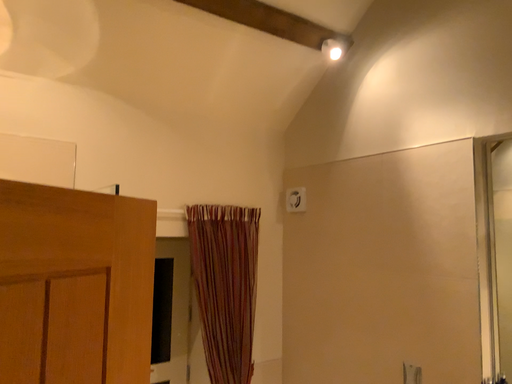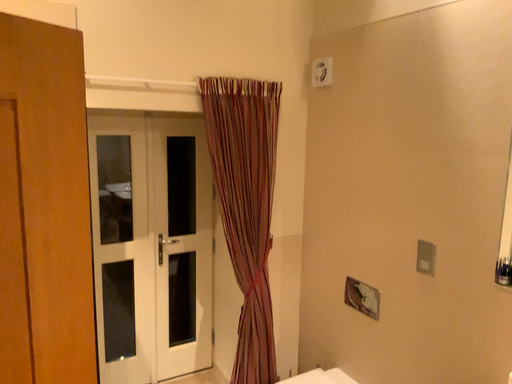
Question: How did the camera likely rotate when shooting the video?

Choices:
 (A) rotated downward
 (B) rotated upward

Answer: (A)